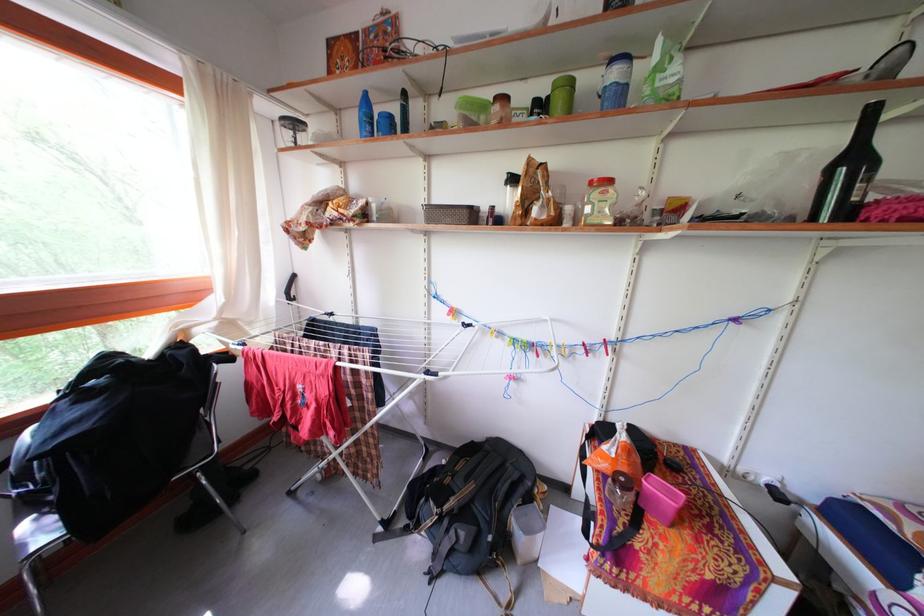
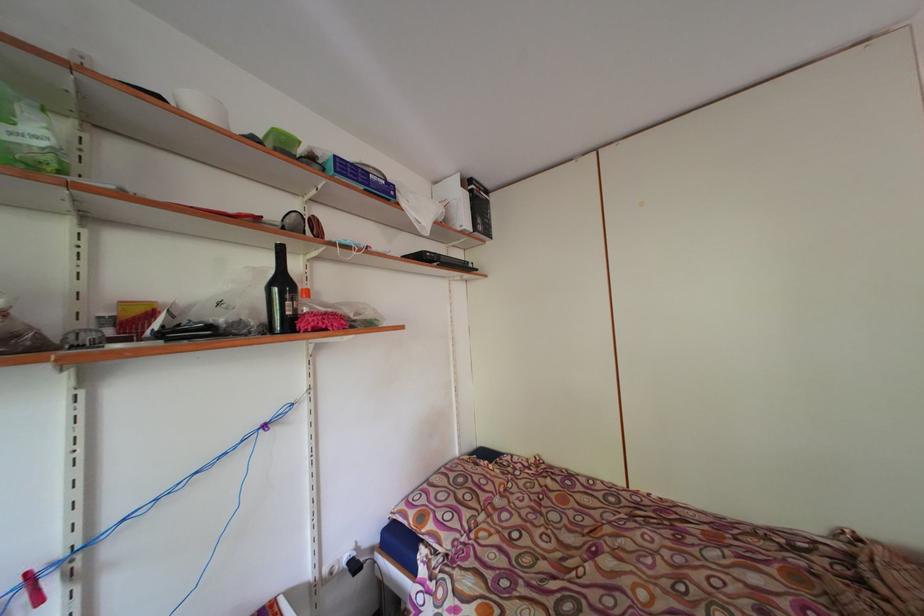
The point at (684, 211) is marked in the first image. Where is the corresponding point in the second image?

(144, 317)